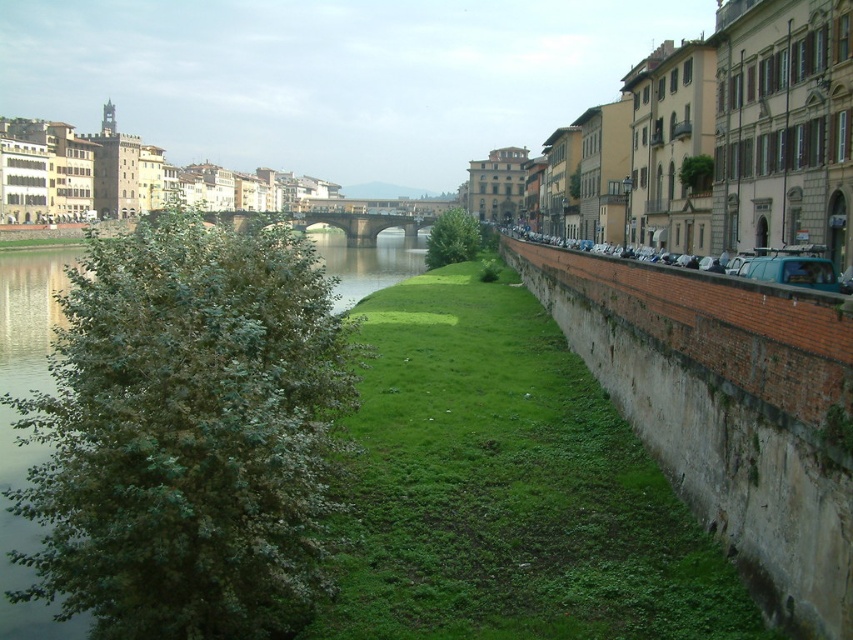
Can you confirm if green leafy tree at left is taller than green leafy tree at center?

Yes.

Which is in front, point (157, 292) or point (451, 256)?

Point (157, 292) is more forward.

This screenshot has width=853, height=640. Identify the location of green leafy tree at left. (189, 433).

Is green grassy at center positioned at the back of green leafy tree at center?

No, it is not.

Based on the photo, which of these two, green grassy at center or green leafy tree at center, stands taller?

green grassy at center is taller.

You are a GUI agent. You are given a task and a screenshot of the screen. Output one action in this format:
    pyautogui.click(x=<x>, y=<y>)
    Task: Click on the green grassy at center
    The height and width of the screenshot is (640, 853).
    Given the screenshot: What is the action you would take?
    pyautogui.click(x=508, y=488)

In the scene shown: Who is shorter, green leafy tree at left or green grassy at center?

green grassy at center is shorter.

Does green leafy tree at left appear on the right side of green grassy at center?

Incorrect, green leafy tree at left is not on the right side of green grassy at center.

Measure the distance between point (235,369) and camera.

A distance of 198.34 feet exists between point (235,369) and camera.

Where is `green leafy tree at left`? green leafy tree at left is located at coordinates (189, 433).